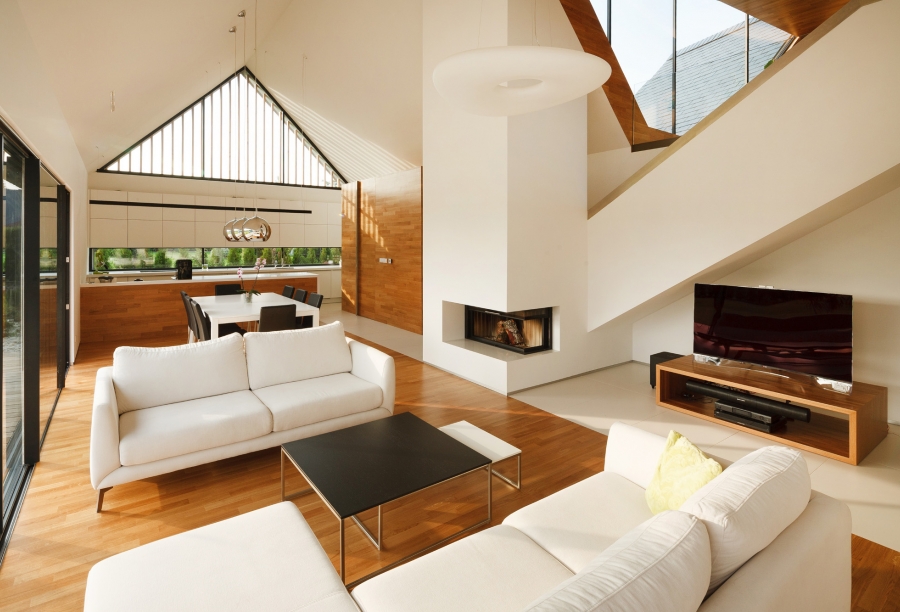
Identify the location of pans. Image resolution: width=900 pixels, height=612 pixels. (256, 228), (237, 223), (228, 233).